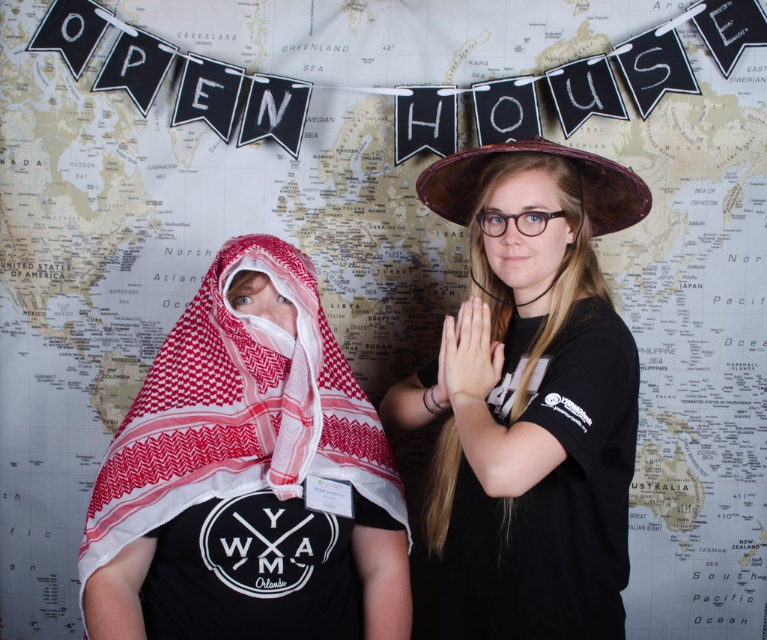
Question: Can you confirm if red and white woven cloth at left is thinner than black matte hat at center?

Choices:
 (A) yes
 (B) no

Answer: (B)

Question: Does red and white woven cloth at left appear on the right side of black matte hat at center?

Choices:
 (A) yes
 (B) no

Answer: (B)

Question: Among these objects, which one is farthest from the camera?

Choices:
 (A) black matte hat at center
 (B) red and white woven cloth at left

Answer: (B)

Question: Which of the following is the farthest from the observer?

Choices:
 (A) red and white woven cloth at left
 (B) black matte hat at center

Answer: (A)

Question: Which point is closer to the camera?

Choices:
 (A) (110, 609)
 (B) (463, 417)

Answer: (B)

Question: Considering the relative positions of red and white woven cloth at left and black matte hat at center in the image provided, where is red and white woven cloth at left located with respect to black matte hat at center?

Choices:
 (A) below
 (B) above

Answer: (A)